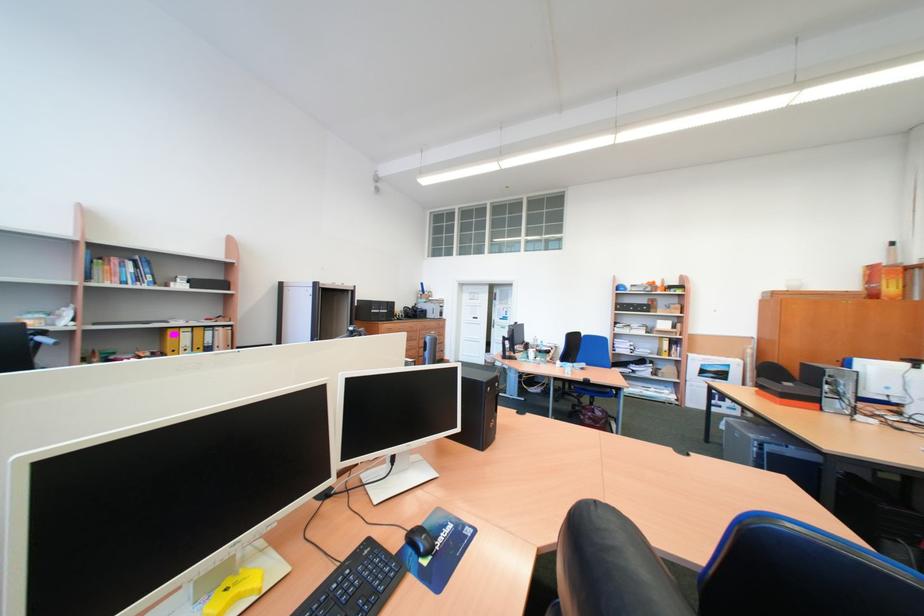
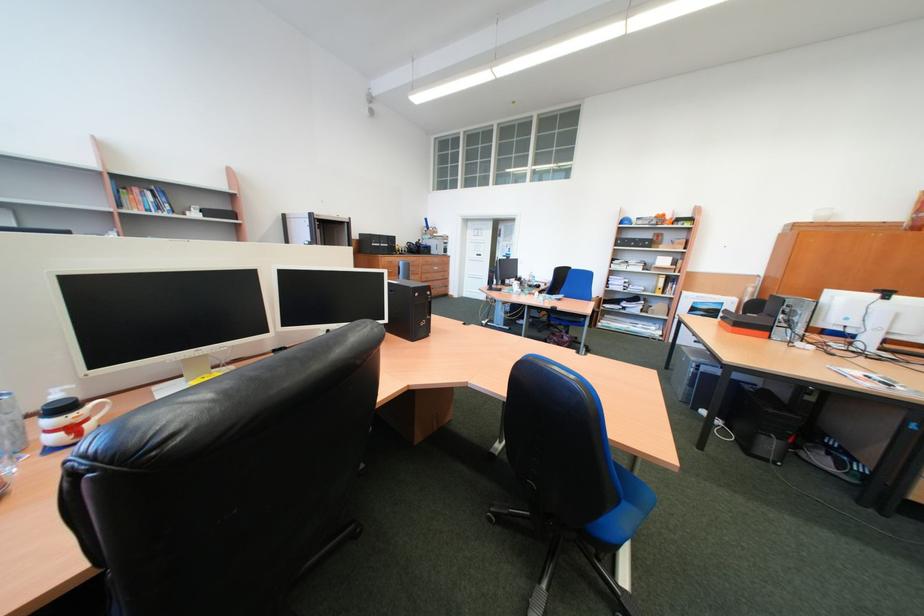
The point at (103, 280) is marked in the first image. Where is the corresponding point in the second image?

(134, 207)